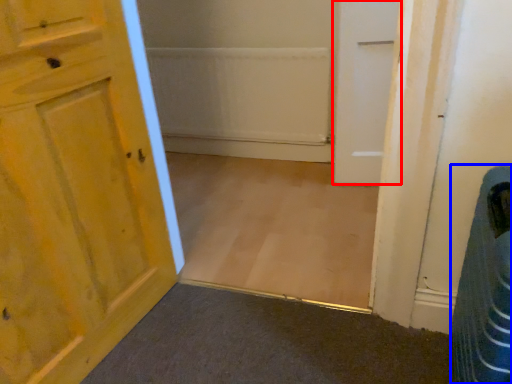
Question: Among these objects, which one is nearest to the camera, door (highlighted by a red box) or laundry basket (highlighted by a blue box)?

Choices:
 (A) door
 (B) laundry basket

Answer: (B)